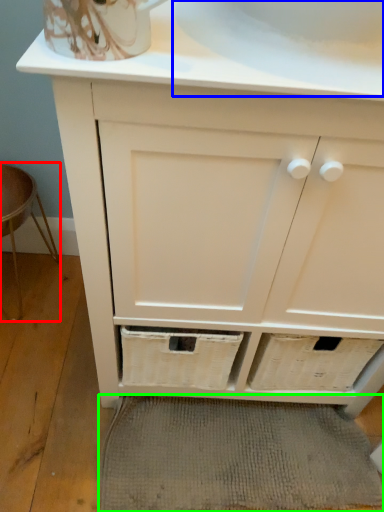
Question: Based on their relative distances, which object is nearer to bar stool (highlighted by a red box)? Choose from sink (highlighted by a blue box) and bath mat (highlighted by a green box).

Choices:
 (A) sink
 (B) bath mat

Answer: (B)